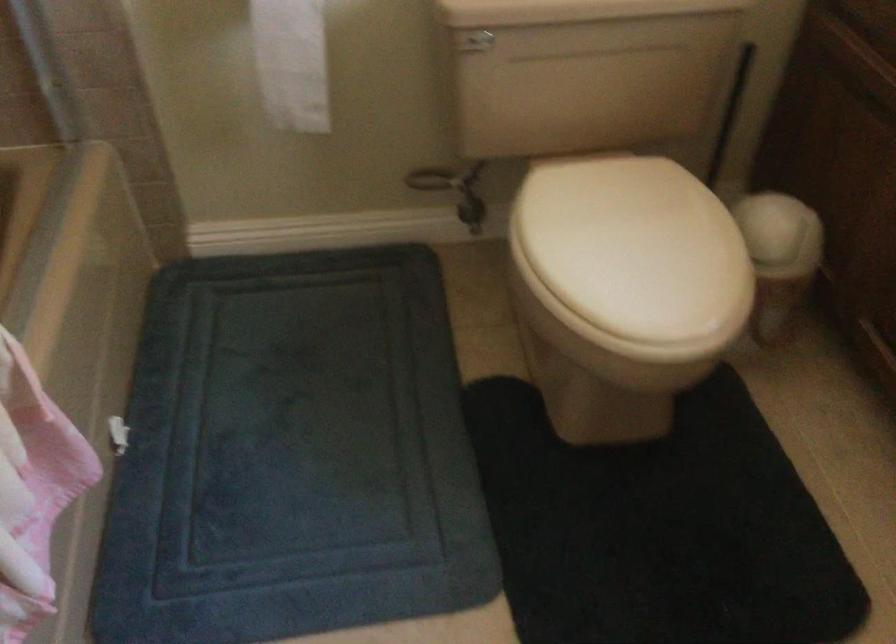
Find where to push the trash can lid. Please return your answer as a coordinate pair (x, y).

(780, 234)